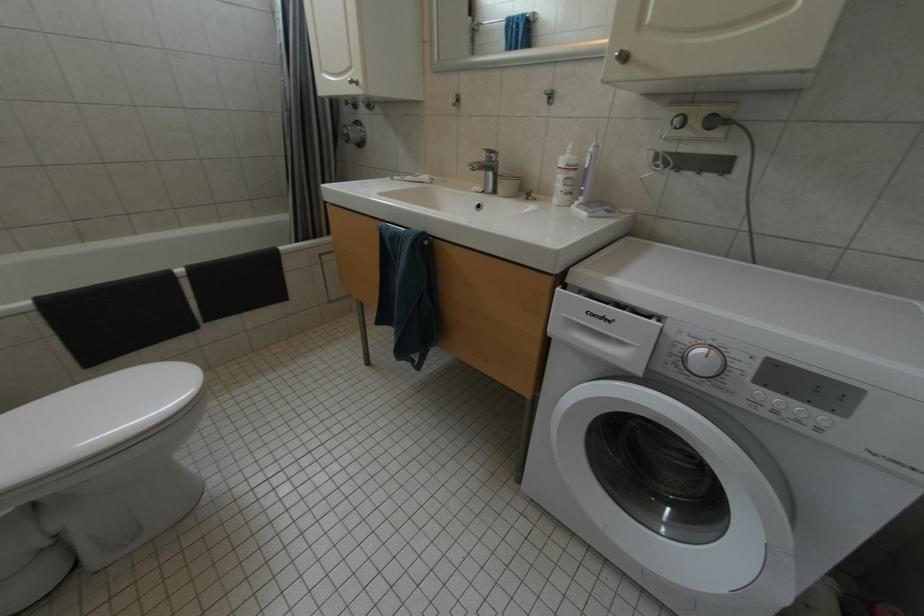
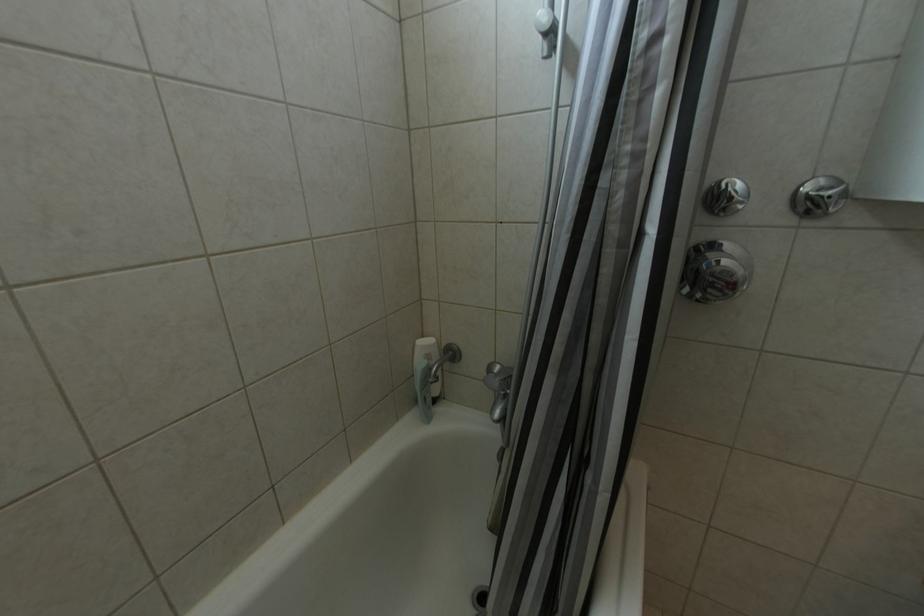
Which direction would the cameraman need to move to produce the second image?

The movement direction of the cameraman is left, forward.